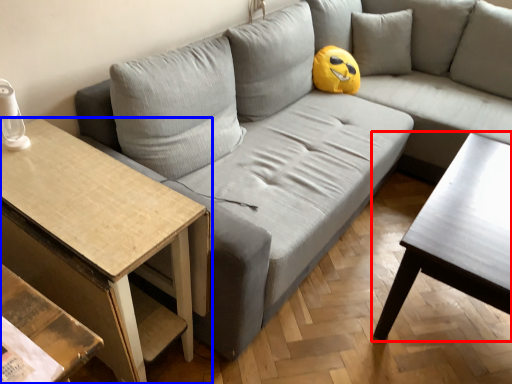
Question: Which point is further to the camera, coffee table (highlighted by a red box) or table (highlighted by a blue box)?

Choices:
 (A) coffee table
 (B) table

Answer: (A)